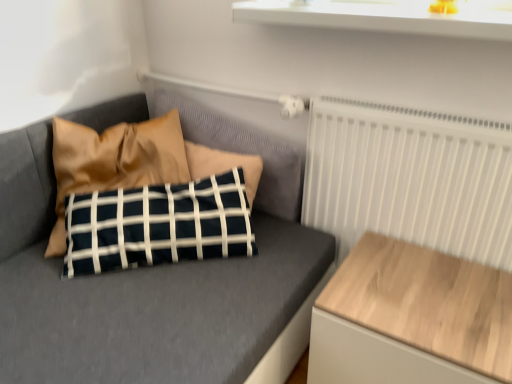
Question: From their relative heights in the image, would you say wooden table at right is taller or shorter than matte black pillow at center?

Choices:
 (A) short
 (B) tall

Answer: (A)

Question: From a real-world perspective, is wooden table at right positioned above or below matte black pillow at center?

Choices:
 (A) above
 (B) below

Answer: (B)

Question: Which object is positioned farthest from the matte black pillow at center?

Choices:
 (A) white matte radiator at upper right
 (B) white glossy window sill at upper center
 (C) satin brown pillow at upper left
 (D) wooden table at right

Answer: (B)

Question: Based on their relative distances, which object is farther from the wooden table at right?

Choices:
 (A) white glossy window sill at upper center
 (B) satin brown pillow at upper left
 (C) white matte radiator at upper right
 (D) matte black pillow at center

Answer: (B)